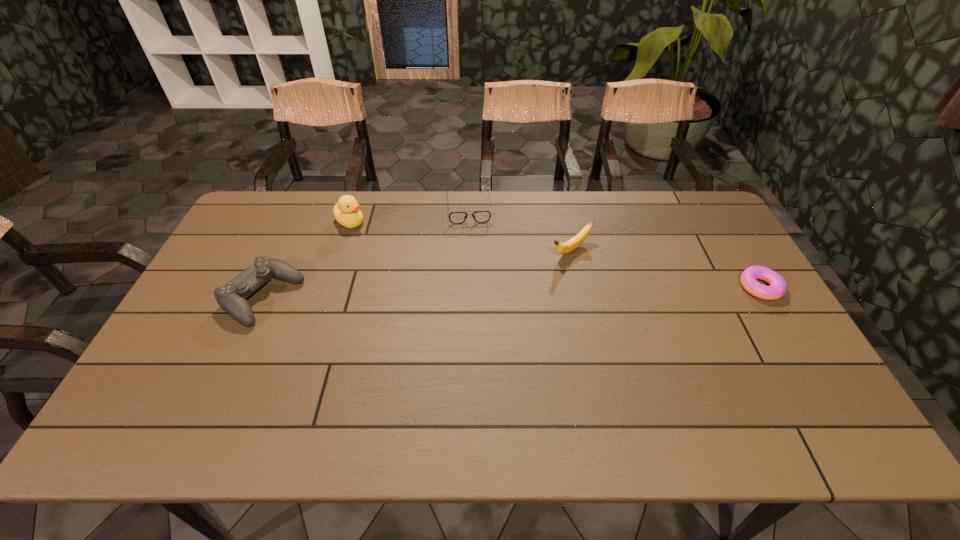
At what (x,y) coordinates should I click in order to perform the action: click on the leftmost object. Please return your answer as a coordinate pair (x, y). This screenshot has width=960, height=540. Looking at the image, I should click on pyautogui.click(x=232, y=297).

Identify the location of the third tallest object. This screenshot has height=540, width=960. click(x=232, y=297).

Locate an element on the screen. This screenshot has width=960, height=540. the rightmost object is located at coordinates (777, 288).

Locate an element on the screen. The height and width of the screenshot is (540, 960). the shortest object is located at coordinates (777, 288).

The height and width of the screenshot is (540, 960). What are the coordinates of `the third nearest object` in the screenshot? It's located at (566, 247).

Locate an element on the screen. The image size is (960, 540). banana is located at coordinates (566, 247).

At what (x,y) coordinates should I click in order to perform the action: click on sunglasses. Please return your answer as a coordinate pair (x, y). The width and height of the screenshot is (960, 540). Looking at the image, I should click on (479, 216).

Identify the location of the fourth tallest object. Image resolution: width=960 pixels, height=540 pixels. (479, 216).

I want to click on the fourth object from right to left, so click(347, 212).

You are a GUI agent. You are given a task and a screenshot of the screen. Output one action in this format:
    pyautogui.click(x=<x>, y=<y>)
    Task: Click on the duckling
    This screenshot has height=540, width=960.
    Given the screenshot: What is the action you would take?
    pyautogui.click(x=347, y=212)